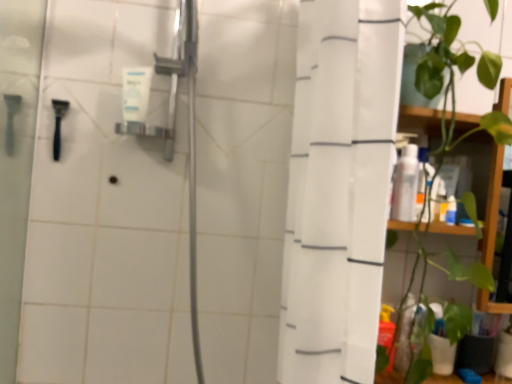
Question: From the image's perspective, is green leafy plant at right located above or below white matte tube at upper center, which is the first toiletry in top-to-bottom order?

Choices:
 (A) above
 (B) below

Answer: (B)

Question: Which is correct: green leafy plant at right is inside white matte tube at upper center, the 2th toiletry positioned from the bottom, or outside of it?

Choices:
 (A) outside
 (B) inside

Answer: (A)

Question: Which is nearer to the black plastic razor at left?

Choices:
 (A) white glossy bottle at right, the second toiletry when ordered from top to bottom
 (B) green leafy plant at right
 (C) white fabric shower curtain at right
 (D) white matte tube at upper center, acting as the second toiletry starting from the right

Answer: (D)

Question: Estimate the real-world distances between objects in this image. Which object is farther from the white matte tube at upper center, the 2th toiletry positioned from the bottom?

Choices:
 (A) black plastic razor at left
 (B) white fabric shower curtain at right
 (C) white glossy bottle at right, marked as the first toiletry in a bottom-to-top arrangement
 (D) green leafy plant at right

Answer: (D)